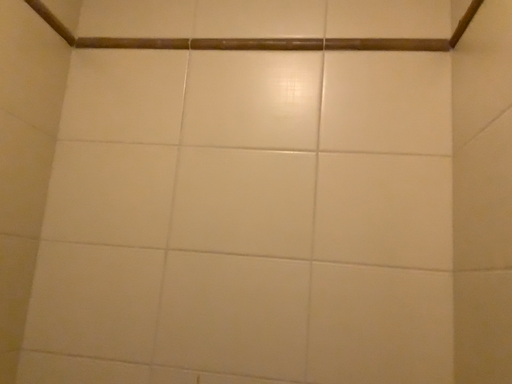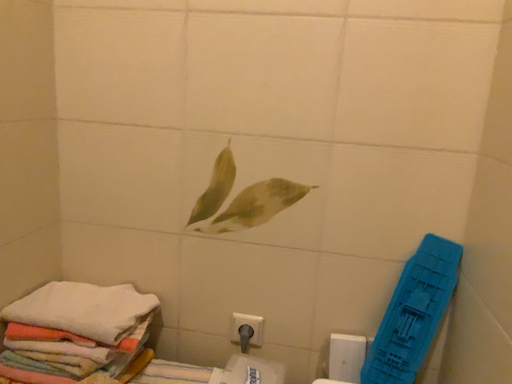
Question: How did the camera likely rotate when shooting the video?

Choices:
 (A) rotated downward
 (B) rotated upward

Answer: (A)